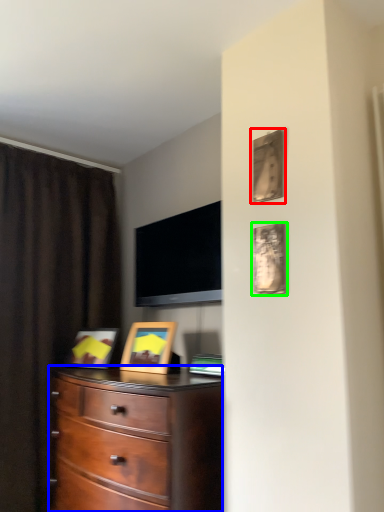
Question: Which is nearer to the picture frame (highlighted by a red box)? chest of drawers (highlighted by a blue box) or picture frame (highlighted by a green box).

Choices:
 (A) chest of drawers
 (B) picture frame

Answer: (B)